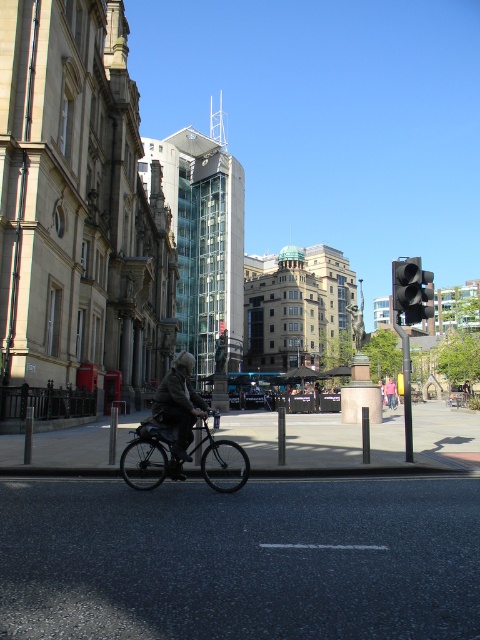
Question: Is dark gray fabric jacket at center further to camera compared to denim jacket at center?

Choices:
 (A) no
 (B) yes

Answer: (A)

Question: Which point is closer to the camera taking this photo?

Choices:
 (A) (422, 307)
 (B) (187, 426)
 (C) (393, 401)
 (D) (226, 476)

Answer: (B)

Question: Which point is farther from the camera taking this photo?

Choices:
 (A) (384, 385)
 (B) (419, 288)
 (C) (182, 406)

Answer: (A)

Question: Which object is closer to the camera taking this photo?

Choices:
 (A) dark gray fabric jacket at center
 (B) shiny metallic bicycle at center

Answer: (A)

Question: Is dark gray fabric jacket at center smaller than black matte traffic light at upper right?

Choices:
 (A) no
 (B) yes

Answer: (B)

Question: Can you confirm if shiny metallic bicycle at center is positioned above denim jacket at center?

Choices:
 (A) yes
 (B) no

Answer: (A)